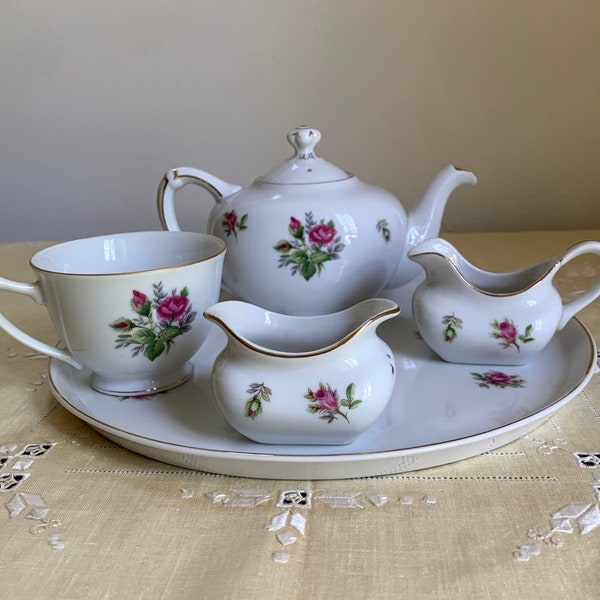
Locate an element on the screen. Image resolution: width=600 pixels, height=600 pixels. cloth is located at coordinates (164, 551).